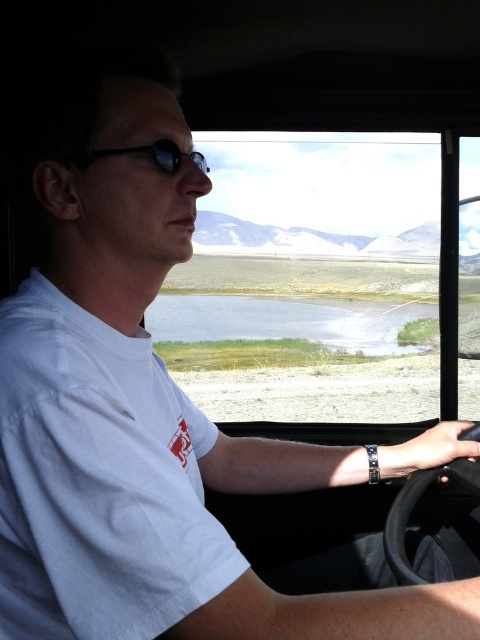
Question: Can you confirm if white cotton t-shirt at left is thinner than sunglasses at center?

Choices:
 (A) no
 (B) yes

Answer: (A)

Question: Which object is farther from the camera taking this photo?

Choices:
 (A) white cotton t-shirt at left
 (B) sunglasses at center

Answer: (B)

Question: Considering the relative positions of white cotton t-shirt at left and sunglasses at center in the image provided, where is white cotton t-shirt at left located with respect to sunglasses at center?

Choices:
 (A) right
 (B) left

Answer: (B)

Question: Which of the following is the farthest from the observer?

Choices:
 (A) white cotton t-shirt at left
 (B) sunglasses at center

Answer: (B)

Question: Can you confirm if white cotton t-shirt at left is smaller than sunglasses at center?

Choices:
 (A) no
 (B) yes

Answer: (A)